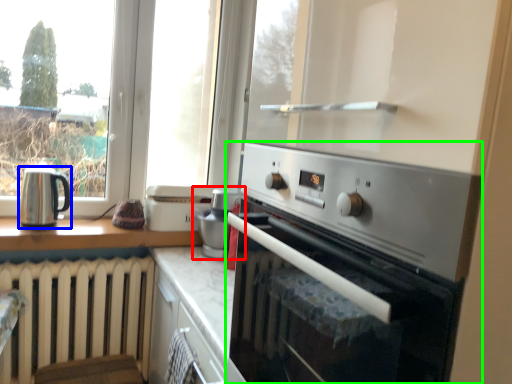
Question: Estimate the real-world distances between objects in this image. Which object is farther from appliance (highlighted by a red box), kitchen appliance (highlighted by a blue box) or home appliance (highlighted by a green box)?

Choices:
 (A) kitchen appliance
 (B) home appliance

Answer: (B)